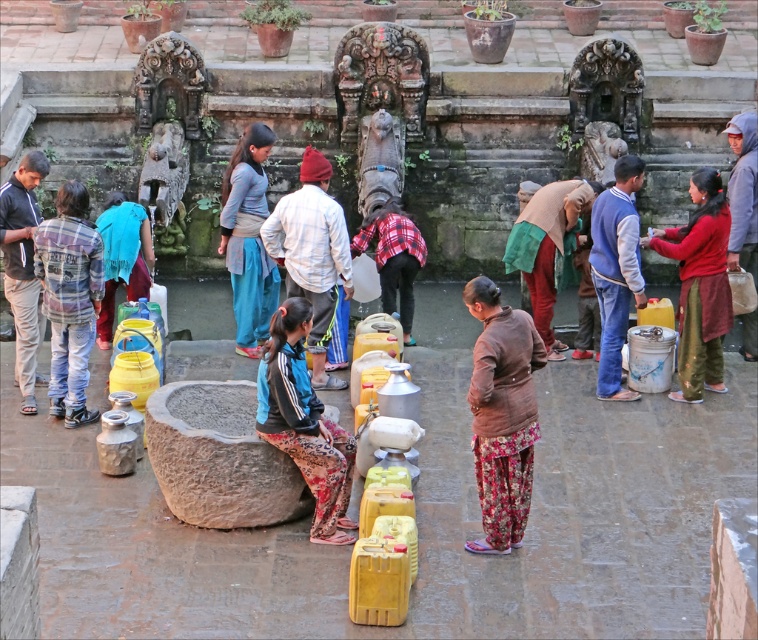
Between red cotton dress at right and brown fabric headscarf at center, which one has less height?

brown fabric headscarf at center

You are a GUI agent. You are given a task and a screenshot of the screen. Output one action in this format:
    pyautogui.click(x=<x>, y=<y>)
    Task: Click on the red cotton dress at right
    
    Given the screenshot: What is the action you would take?
    pyautogui.click(x=699, y=285)

In order to click on plaid fabric shirt at left in this screenshot , I will do `click(69, 298)`.

This screenshot has width=758, height=640. I want to click on plaid fabric shirt at left, so pyautogui.click(x=69, y=298).

How distant is blue fabric jacket at center from brown fabric headscarf at center?

A distance of 18.17 feet exists between blue fabric jacket at center and brown fabric headscarf at center.

Does blue fabric jacket at center appear under brown fabric headscarf at center?

Yes, blue fabric jacket at center is below brown fabric headscarf at center.

This screenshot has width=758, height=640. What do you see at coordinates (304, 422) in the screenshot? I see `blue fabric jacket at center` at bounding box center [304, 422].

Image resolution: width=758 pixels, height=640 pixels. In order to click on blue fabric jacket at center in this screenshot , I will do `click(304, 422)`.